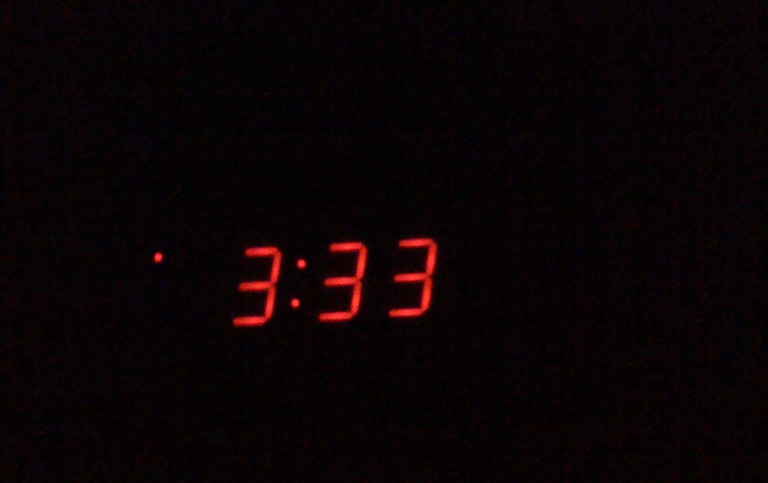
Where is `led`? The image size is (768, 483). led is located at coordinates [247, 323], [267, 306], [257, 284], [273, 270], [263, 251].